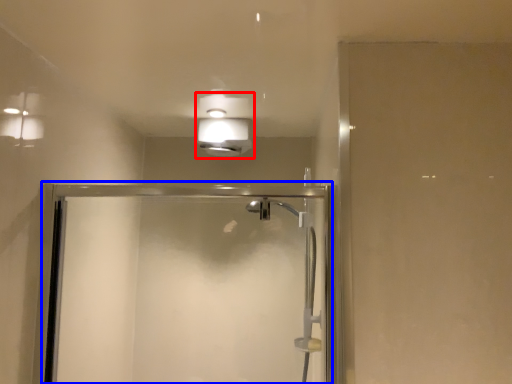
Question: Which of the following is the closest to the observer, light fixture (highlighted by a red box) or screen door (highlighted by a blue box)?

Choices:
 (A) light fixture
 (B) screen door

Answer: (B)